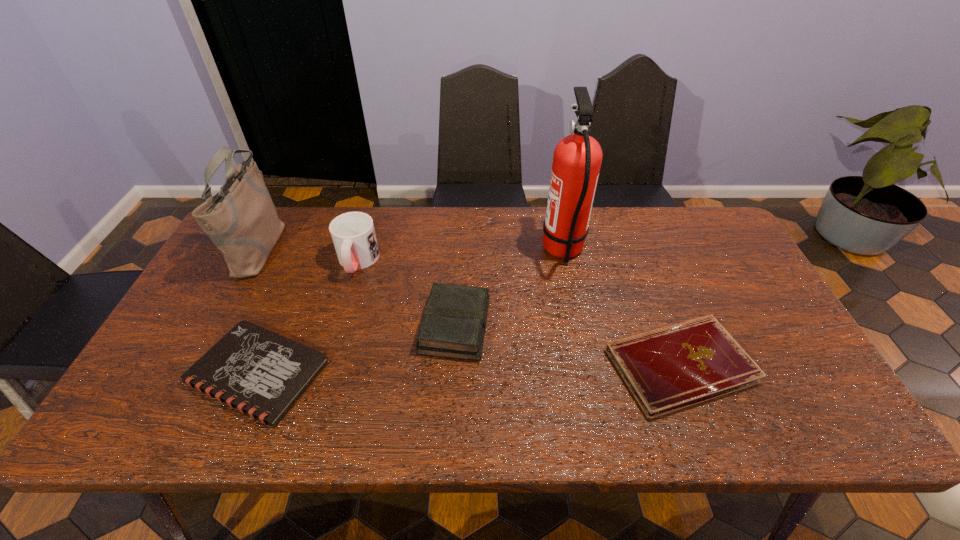
Where is `vacant space located 0.090m on the front-facing side of the shoulder bag`? vacant space located 0.090m on the front-facing side of the shoulder bag is located at coordinates (311, 246).

This screenshot has height=540, width=960. What are the coordinates of `blank space located on the side of the fourth shortest object with the handle` in the screenshot? It's located at click(324, 379).

Locate an element on the screen. free space located on the back of the fourth tallest object is located at coordinates (458, 263).

The height and width of the screenshot is (540, 960). I want to click on free space located on the left of the right notebook, so click(x=501, y=366).

The width and height of the screenshot is (960, 540). Identify the location of free region located 0.190m on the back of the left notebook. (298, 275).

The width and height of the screenshot is (960, 540). Find the location of `fire extinguisher that is positioned at the far edge`. fire extinguisher that is positioned at the far edge is located at coordinates (577, 158).

This screenshot has width=960, height=540. What are the coordinates of `shoulder bag at the far edge` in the screenshot? It's located at (241, 220).

What are the coordinates of `mug positioned at the far edge` in the screenshot? It's located at (353, 234).

Identify the location of shoulder bag present at the left edge. This screenshot has width=960, height=540. (241, 220).

Locate an element on the screen. notebook that is at the left edge is located at coordinates (261, 373).